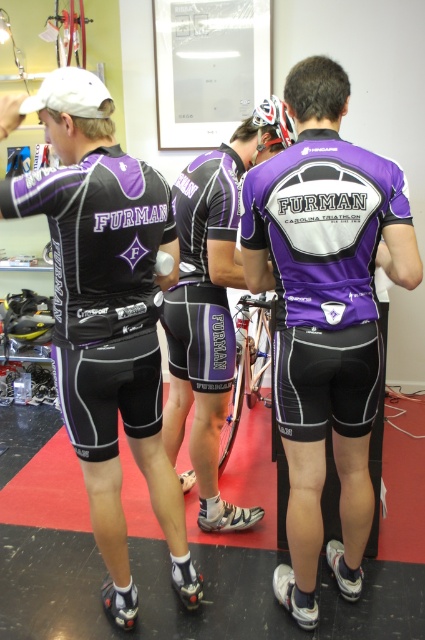
Question: Which point is farther to the camera?

Choices:
 (A) (39, 296)
 (B) (249, 394)

Answer: (A)

Question: Which object appears farthest from the camera in this image?

Choices:
 (A) matte black tri suit at center
 (B) shiny multicolored helmet at center
 (C) purple matte shorts at center

Answer: (B)

Question: Is purple matte shorts at center to the left of purple matte tri suit at center from the viewer's perspective?

Choices:
 (A) no
 (B) yes

Answer: (A)

Question: Does matte black cycling jersey at left appear on the right side of black matte bicycle helmet at lower left?

Choices:
 (A) no
 (B) yes

Answer: (B)

Question: Among these points, which one is nearest to the camera?

Choices:
 (A) (113, 506)
 (B) (240, 376)

Answer: (A)

Question: Is matte black cycling jersey at left bigger than purple matte tri suit at center?

Choices:
 (A) yes
 (B) no

Answer: (A)